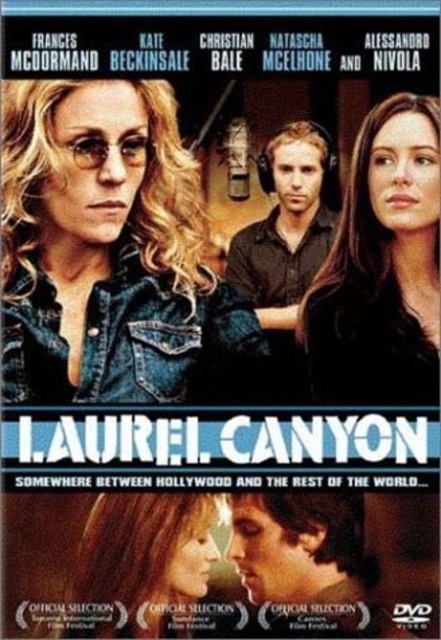
Question: Does smooth brown hair at center have a smaller size compared to brown leather shirt at center?

Choices:
 (A) yes
 (B) no

Answer: (B)

Question: Does smooth brown hair at center have a greater width compared to blonde hair at lower center?

Choices:
 (A) no
 (B) yes

Answer: (B)

Question: Considering the real-world distances, which object is farthest from the blonde hair at lower center?

Choices:
 (A) smooth skin face at lower center
 (B) brown leather shirt at center
 (C) denim jacket at upper left

Answer: (B)

Question: Estimate the real-world distances between objects in this image. Which object is closer to the brown leather shirt at center?

Choices:
 (A) blonde hair at lower center
 (B) smooth skin face at lower center
 (C) smooth brown hair at center

Answer: (C)

Question: Which object is farther from the camera taking this photo?

Choices:
 (A) blonde hair at lower center
 (B) smooth brown hair at center

Answer: (B)

Question: Can you confirm if blonde hair at lower center is positioned to the left of smooth skin face at lower center?

Choices:
 (A) no
 (B) yes

Answer: (B)